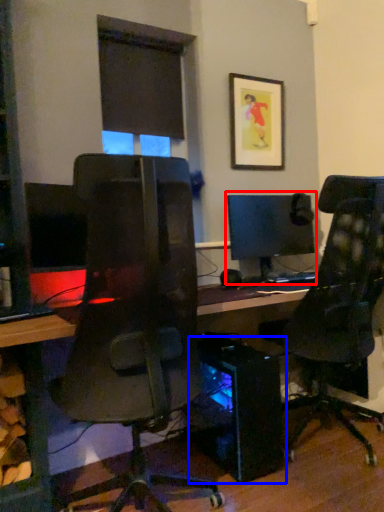
Question: Which object is closer to the camera taking this photo, computer monitor (highlighted by a red box) or computer tower (highlighted by a blue box)?

Choices:
 (A) computer monitor
 (B) computer tower

Answer: (B)